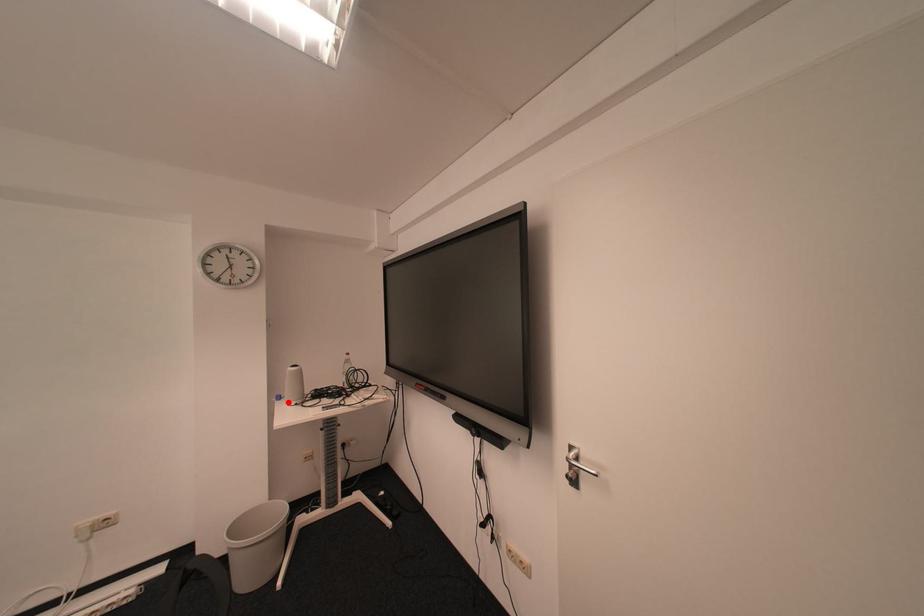
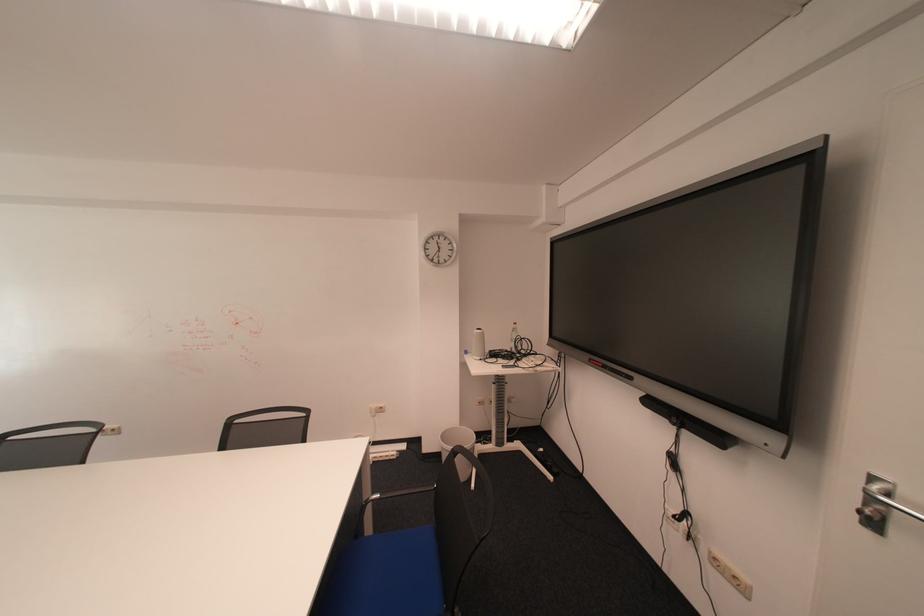
Find the pixel in the second image that matches the highlighted location in the first image.

(477, 355)